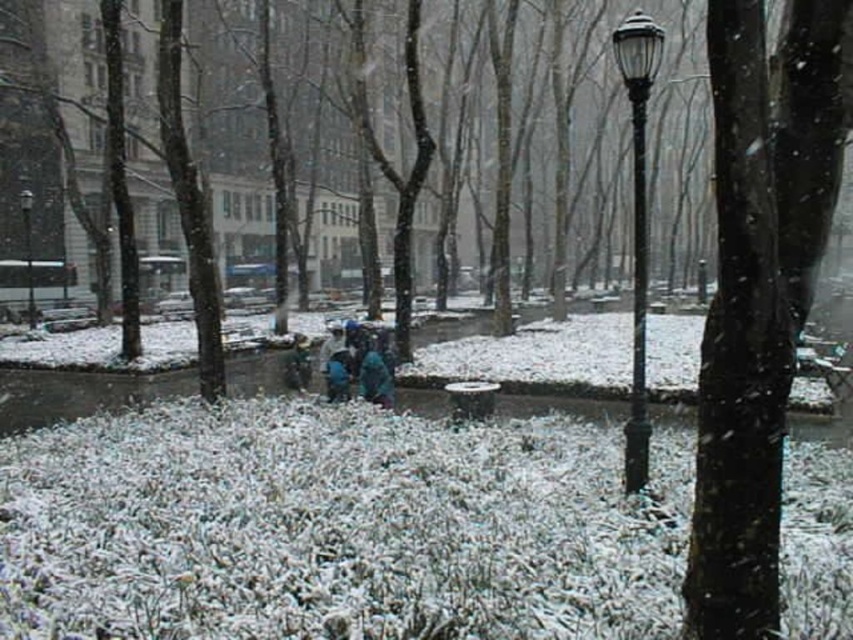
Locate an element on the screen. black polished metal lamp post at right is located at coordinates (637, 224).

Between point (639, 224) and point (28, 296), which one is positioned behind?

The point (28, 296) is more distant.

Image resolution: width=853 pixels, height=640 pixels. I want to click on black polished metal lamp post at right, so click(637, 224).

Between black smooth tree trunk at center and black glass lamp post at center, which one has more height?

With more height is black glass lamp post at center.

Locate an element on the screen. The height and width of the screenshot is (640, 853). black smooth tree trunk at center is located at coordinates (758, 296).

Find the location of a particular element. The image size is (853, 640). black smooth tree trunk at center is located at coordinates (758, 296).

Is point (776, 388) closer to camera compared to point (633, 84)?

Yes.

Which is below, black smooth tree trunk at center or black polished metal lamp post at right?

black smooth tree trunk at center is lower down.

Locate an element on the screen. This screenshot has width=853, height=640. black smooth tree trunk at center is located at coordinates (758, 296).